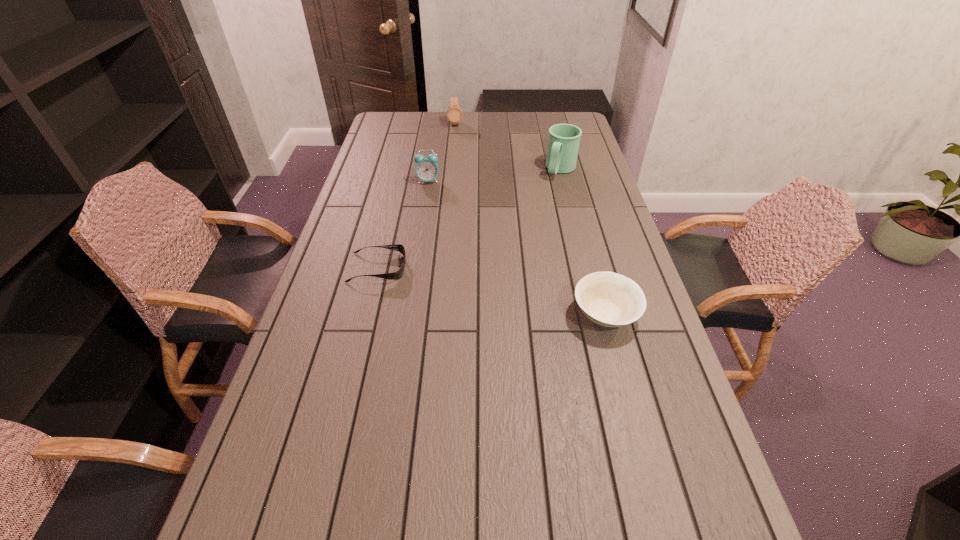
Locate an element on the screen. vacant space that satisfies the following two spatial constraints: 1. on the front side of the mug; 2. on the left side of the second shortest object is located at coordinates (597, 315).

In order to click on free space that satisfies the following two spatial constraints: 1. on the front side of the nearest object; 2. on the left side of the alarm clock in this screenshot , I will do `click(407, 315)`.

Identify the location of vacant space that satisfies the following two spatial constraints: 1. on the front side of the alarm clock; 2. on the right side of the nearest object. This screenshot has width=960, height=540. (407, 315).